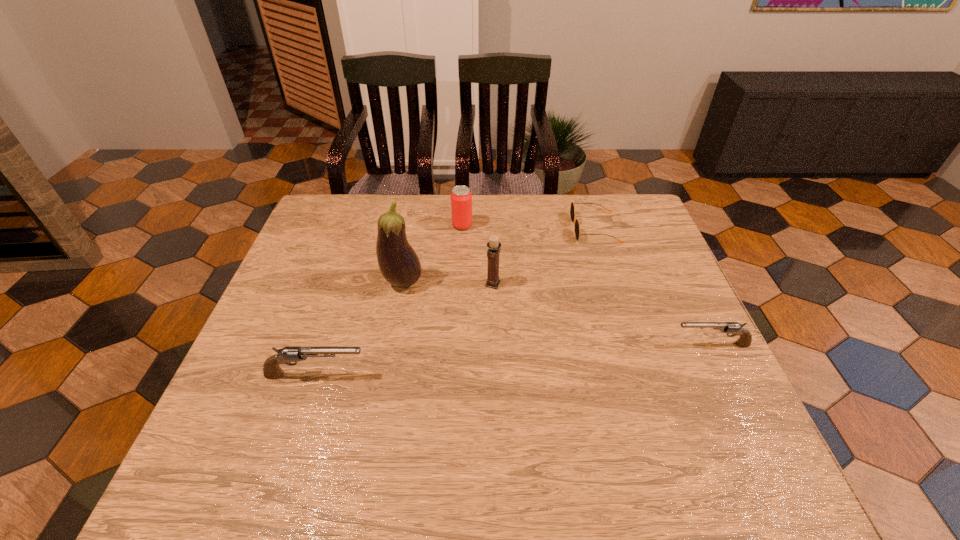
Locate an element on the screen. the taller gun is located at coordinates (271, 369).

Where is `the nearest object`? Image resolution: width=960 pixels, height=540 pixels. the nearest object is located at coordinates (271, 369).

At what (x,y) coordinates should I click in order to perform the action: click on the rightmost object. Please return your answer as a coordinate pair (x, y). The image size is (960, 540). Looking at the image, I should click on (745, 339).

I want to click on the farther gun, so click(x=745, y=339).

Where is `the second object from right to left`? Image resolution: width=960 pixels, height=540 pixels. the second object from right to left is located at coordinates (572, 209).

Locate an element on the screen. The height and width of the screenshot is (540, 960). the shortest object is located at coordinates (572, 209).

Where is `the third object from left to right`? The height and width of the screenshot is (540, 960). the third object from left to right is located at coordinates (461, 198).

This screenshot has width=960, height=540. I want to click on beer can, so click(x=461, y=198).

Locate an element on the screen. the tallest object is located at coordinates (399, 264).

Find the location of a particular element. the fifth shortest object is located at coordinates (494, 245).